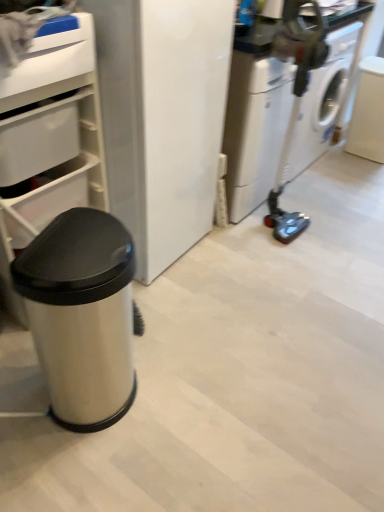
Question: From a real-world perspective, is white plastic drawer at upper left, the second drawer from the bottom, positioned above or below white glossy washing machine at right?

Choices:
 (A) above
 (B) below

Answer: (A)

Question: Would you say white plastic drawer at upper left, the second drawer from the bottom, is inside or outside white glossy washing machine at right?

Choices:
 (A) inside
 (B) outside

Answer: (B)

Question: Considering the real-world distances, which object is closest to the white plastic drawer at upper left, which is counted as the second drawer, starting from the top?

Choices:
 (A) white plastic drawer at upper left, positioned as the first drawer in top-to-bottom order
 (B) satin silver trash can at left
 (C) white glossy washing machine at right

Answer: (A)

Question: Estimate the real-world distances between objects in this image. Which object is closer to the white glossy washing machine at right?

Choices:
 (A) white plastic drawer at upper left, which is the first drawer from bottom to top
 (B) satin silver trash can at left
 (C) white plastic drawer at upper left, the second drawer from the bottom

Answer: (A)